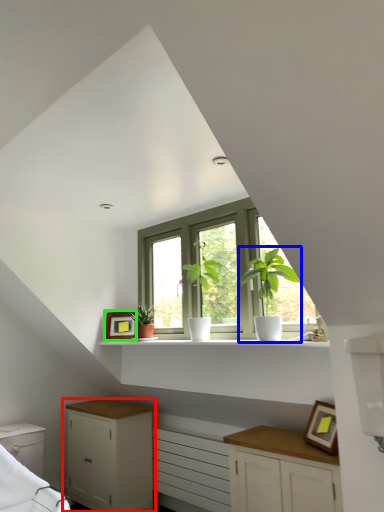
Question: Which object is the closest to the cabinetry (highlighted by a red box)? Choose among these: houseplant (highlighted by a blue box) or picture frame (highlighted by a green box).

Choices:
 (A) houseplant
 (B) picture frame

Answer: (B)